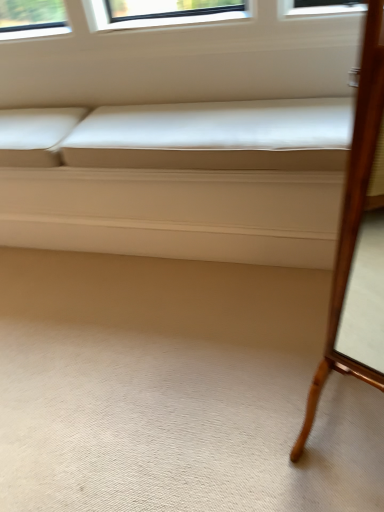
This screenshot has width=384, height=512. Describe the element at coordinates (356, 214) in the screenshot. I see `wooden mirror at right` at that location.

Where is `wooden mirror at right`? wooden mirror at right is located at coordinates (356, 214).

The image size is (384, 512). Describe the element at coordinates (191, 183) in the screenshot. I see `white leather couch at center` at that location.

The width and height of the screenshot is (384, 512). I want to click on white leather couch at center, so click(x=191, y=183).

I want to click on wooden mirror at right, so click(x=356, y=214).

Does wooden mirror at right appear on the left side of white leather couch at center?

Incorrect, wooden mirror at right is not on the left side of white leather couch at center.

Between wooden mirror at right and white leather couch at center, which one is positioned in front?

wooden mirror at right is closer to the camera.

Considering the positions of points (341, 366) and (211, 183), is point (341, 366) closer to camera compared to point (211, 183)?

Yes, it is in front of point (211, 183).

From the image's perspective, which is above, wooden mirror at right or white leather couch at center?

From the image's view, white leather couch at center is above.

From a real-world perspective, is wooden mirror at right under white leather couch at center?

No, from a real-world perspective, wooden mirror at right is not below white leather couch at center.

In terms of width, does wooden mirror at right look wider or thinner when compared to white leather couch at center?

Clearly, wooden mirror at right has less width compared to white leather couch at center.

Who is shorter, wooden mirror at right or white leather couch at center?

white leather couch at center is shorter.

Which of these two, wooden mirror at right or white leather couch at center, is smaller?

wooden mirror at right is smaller.

Is wooden mirror at right situated inside white leather couch at center or outside?

wooden mirror at right cannot be found inside white leather couch at center.

Is wooden mirror at right in contact with white leather couch at center?

wooden mirror at right and white leather couch at center are clearly separated.

Is wooden mirror at right looking in the opposite direction of white leather couch at center?

No, wooden mirror at right is not facing the opposite direction of white leather couch at center.

Locate an element on the screen. The width and height of the screenshot is (384, 512). furniture on the right of the white leather couch at center is located at coordinates (356, 214).

Looking at this image, does white leather couch at center appear on the left side of wooden mirror at right?

Yes, white leather couch at center is to the left of wooden mirror at right.

In the image, is white leather couch at center positioned in front of or behind wooden mirror at right?

Visually, white leather couch at center is located behind wooden mirror at right.

Does point (170, 165) come behind point (355, 243)?

Yes, it is behind point (355, 243).

From the image's perspective, is white leather couch at center over wooden mirror at right?

Yes, from the image's perspective, white leather couch at center is on top of wooden mirror at right.

From a real-world perspective, is white leather couch at center on wooden mirror at right?

Incorrect, from a real-world perspective, white leather couch at center is lower than wooden mirror at right.

Can you confirm if white leather couch at center is thinner than wooden mirror at right?

In fact, white leather couch at center might be wider than wooden mirror at right.

Considering the relative sizes of white leather couch at center and wooden mirror at right in the image provided, is white leather couch at center shorter than wooden mirror at right?

Yes, white leather couch at center is shorter than wooden mirror at right.

Can you confirm if white leather couch at center is smaller than wooden mirror at right?

Incorrect, white leather couch at center is not smaller in size than wooden mirror at right.

Is white leather couch at center inside or outside of wooden mirror at right?

The correct answer is: outside.

Is white leather couch at center next to wooden mirror at right?

white leather couch at center is not next to wooden mirror at right, and they're not touching.

Is white leather couch at center aimed at wooden mirror at right?

No, white leather couch at center is not facing towards wooden mirror at right.

Can you tell me how much white leather couch at center and wooden mirror at right differ in facing direction?

The angle between the facing direction of white leather couch at center and the facing direction of wooden mirror at right is 25.5 degrees.

The height and width of the screenshot is (512, 384). What are the coordinates of `couch that appears above the wooden mirror at right (from the image's perspective)` in the screenshot? It's located at (191, 183).

Where is `couch lying on the left of wooden mirror at right`? The image size is (384, 512). couch lying on the left of wooden mirror at right is located at coordinates (191, 183).

Image resolution: width=384 pixels, height=512 pixels. In order to click on furniture above the white leather couch at center (from a real-world perspective) in this screenshot , I will do click(356, 214).